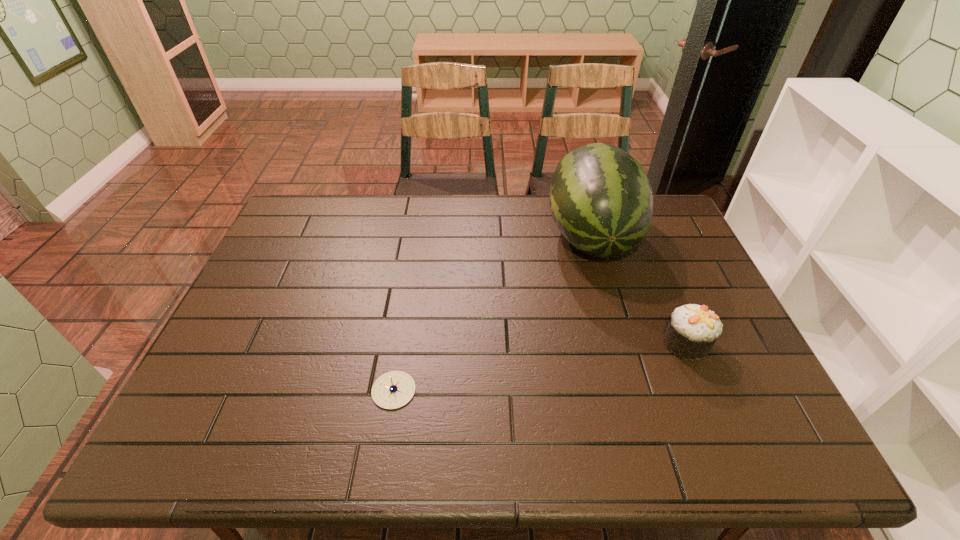
Where is `empty space between the second tallest object and the compass`? empty space between the second tallest object and the compass is located at coordinates (540, 367).

Locate an element on the screen. This screenshot has height=540, width=960. free spot between the shortest object and the watermelon is located at coordinates (492, 313).

Locate an element on the screen. The height and width of the screenshot is (540, 960). unoccupied position between the watermelon and the shortest object is located at coordinates (492, 313).

Where is `free area in between the compass and the cupcake`? Image resolution: width=960 pixels, height=540 pixels. free area in between the compass and the cupcake is located at coordinates (540, 367).

You are a GUI agent. You are given a task and a screenshot of the screen. Output one action in this format:
    pyautogui.click(x=<x>, y=<y>)
    Task: Click on the vacant space in between the farthest object and the nearest object
    The width and height of the screenshot is (960, 540).
    Given the screenshot: What is the action you would take?
    pyautogui.click(x=492, y=313)

The height and width of the screenshot is (540, 960). Identify the location of free area in between the second tallest object and the leftmost object. (540, 367).

In order to click on empty space that is in between the leftmost object and the second tallest object in this screenshot , I will do `click(540, 367)`.

Locate an element on the screen. This screenshot has height=540, width=960. free spot between the shortest object and the farthest object is located at coordinates (492, 313).

Select which object appears as the closest to the farthest object. Please provide its 2D coordinates. Your answer should be formatted as a tuple, i.e. [(x, y)], where the tuple contains the x and y coordinates of a point satisfying the conditions above.

[(693, 329)]

I want to click on the second closest object to the second shortest object, so click(394, 389).